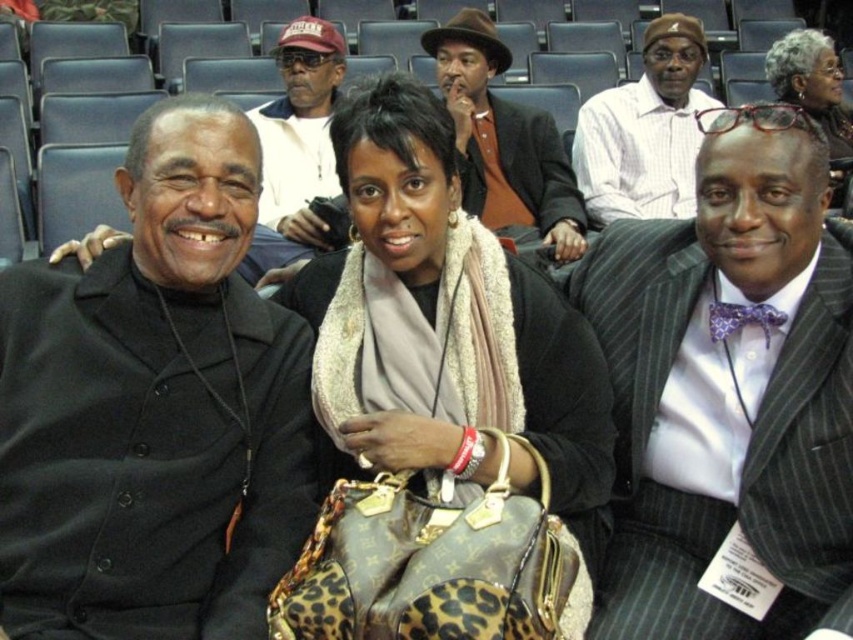
Does pinstriped suit at center appear on the left side of matte black jacket at center?

Incorrect, pinstriped suit at center is not on the left side of matte black jacket at center.

Does pinstriped suit at center lie in front of matte black jacket at center?

Yes, it is.

Does point (793, 340) come farther from viewer compared to point (268, 112)?

No, (793, 340) is in front of (268, 112).

Locate an element on the screen. pinstriped suit at center is located at coordinates pyautogui.click(x=728, y=387).

Can you confirm if white striped shirt at upper center is shorter than matte black hair at center?

Yes, white striped shirt at upper center is shorter than matte black hair at center.

Is white striped shirt at upper center positioned in front of matte black hair at center?

Yes, white striped shirt at upper center is in front of matte black hair at center.

Between point (654, 52) and point (817, 54), which one is positioned behind?

The point (817, 54) is behind.

You are a GUI agent. You are given a task and a screenshot of the screen. Output one action in this format:
    pyautogui.click(x=<x>, y=<y>)
    Task: Click on the white striped shirt at upper center
    
    Given the screenshot: What is the action you would take?
    pyautogui.click(x=645, y=131)

Looking at this image, is black matte suit at left smaller than matte black hair at center?

Yes, black matte suit at left is smaller than matte black hair at center.

Can you confirm if black matte suit at left is positioned above matte black hair at center?

Incorrect, black matte suit at left is not positioned above matte black hair at center.

Who is more distant from viewer, (207, 442) or (809, 45)?

Positioned behind is point (809, 45).

Locate an element on the screen. The width and height of the screenshot is (853, 640). black matte suit at left is located at coordinates (154, 410).